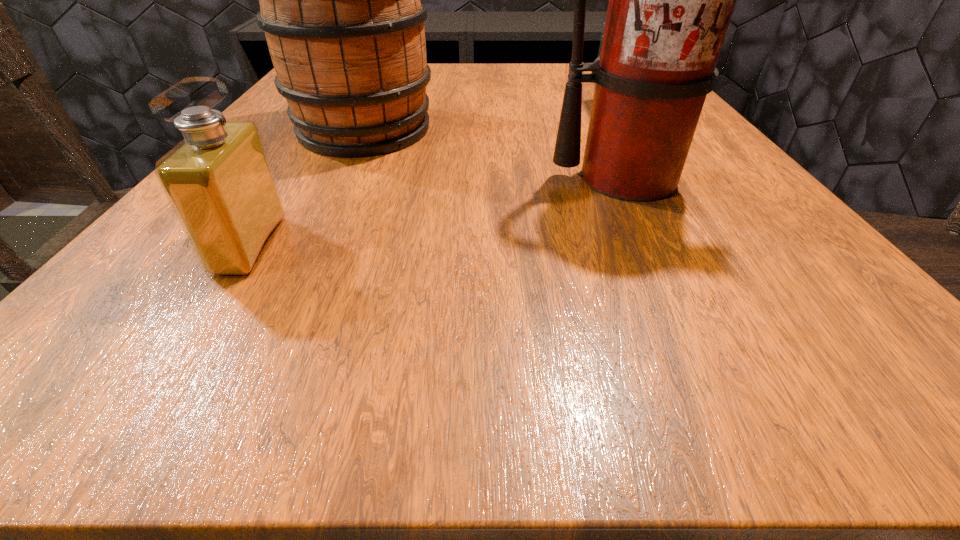
Where is `free space that satisfies the following two spatial constraints: 1. on the front label of the right perfume; 2. toward the nozzle of the tallest object`? Image resolution: width=960 pixels, height=540 pixels. free space that satisfies the following two spatial constraints: 1. on the front label of the right perfume; 2. toward the nozzle of the tallest object is located at coordinates (654, 178).

Identify the location of free region that satisfies the following two spatial constraints: 1. toward the nozzle of the fire extinguisher; 2. on the front-facing side of the left perfume. (659, 245).